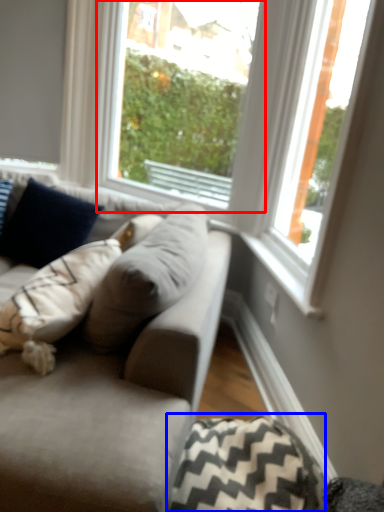
Question: Which object is further to the camera taking this photo, window (highlighted by a red box) or pillow (highlighted by a blue box)?

Choices:
 (A) window
 (B) pillow

Answer: (A)